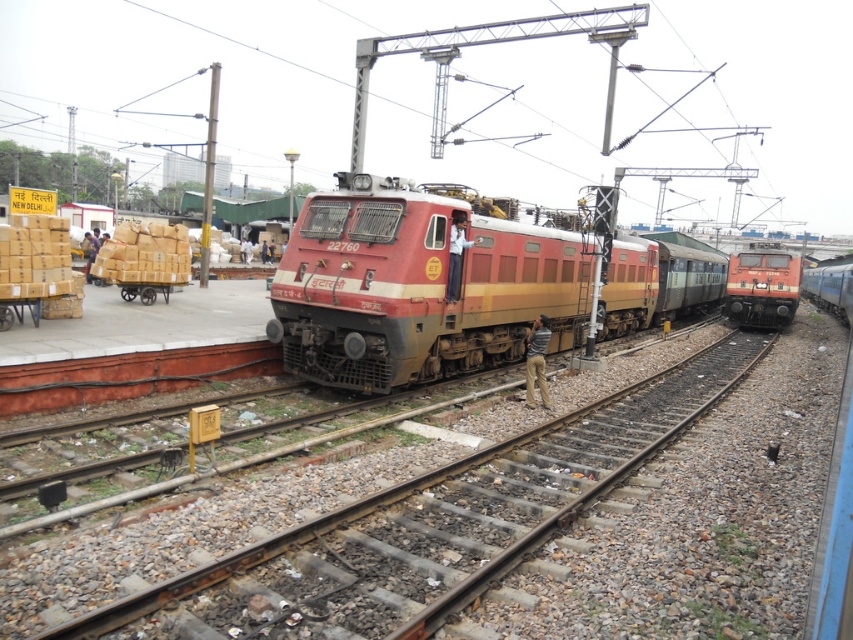
Question: Which of the following is the closest to the observer?

Choices:
 (A) (770, 301)
 (B) (723, 369)
 (C) (827, 268)
 (D) (141, 296)

Answer: (D)

Question: Does matte orange train at right appear on the left side of wooden cart at left?

Choices:
 (A) yes
 (B) no

Answer: (B)

Question: Which point is farther to the camera?

Choices:
 (A) matte orange train at right
 (B) matte red train at center
 (C) blue metallic train at right
 (D) rusty metal train track at center

Answer: (C)

Question: Among these points, which one is nearest to the camera?

Choices:
 (A) (270, 324)
 (B) (132, 291)

Answer: (A)

Question: Does matte red train at center have a greater width compared to matte orange train at right?

Choices:
 (A) yes
 (B) no

Answer: (A)

Question: In this image, where is matte red train at center located relative to wooden cart at left?

Choices:
 (A) right
 (B) left

Answer: (A)